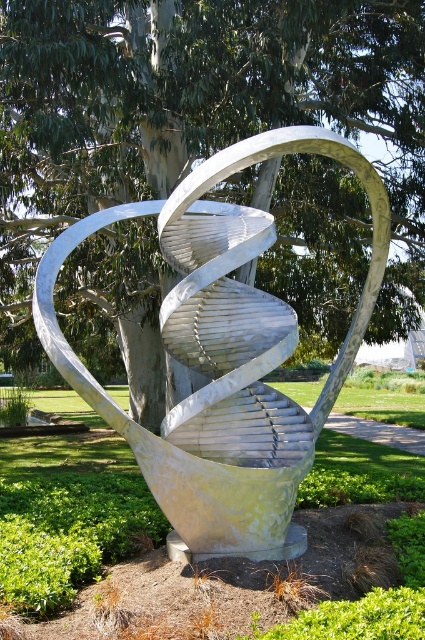
Is silver metallic spiral at center closer to the viewer compared to metallic silver sculpture at center?

No.

In the scene shown: Does silver metallic spiral at center appear over metallic silver sculpture at center?

Yes.

Identify the location of silver metallic spiral at center. The height and width of the screenshot is (640, 425). (223, 356).

Which is more to the left, green leafy tree at center or silver metallic spiral at center?

Positioned to the left is green leafy tree at center.

Who is shorter, green leafy tree at center or silver metallic spiral at center?

silver metallic spiral at center

Describe the element at coordinates (210, 99) in the screenshot. The height and width of the screenshot is (640, 425). I see `green leafy tree at center` at that location.

The image size is (425, 640). What are the coordinates of `green leafy tree at center` in the screenshot? It's located at (210, 99).

What do you see at coordinates (210, 99) in the screenshot?
I see `green leafy tree at center` at bounding box center [210, 99].

Based on the photo, who is more forward, (8, 106) or (85, 547)?

Point (85, 547) is more forward.

Find the location of `green leafy tree at center`. green leafy tree at center is located at coordinates (210, 99).

The height and width of the screenshot is (640, 425). I want to click on green leafy tree at center, so click(x=210, y=99).